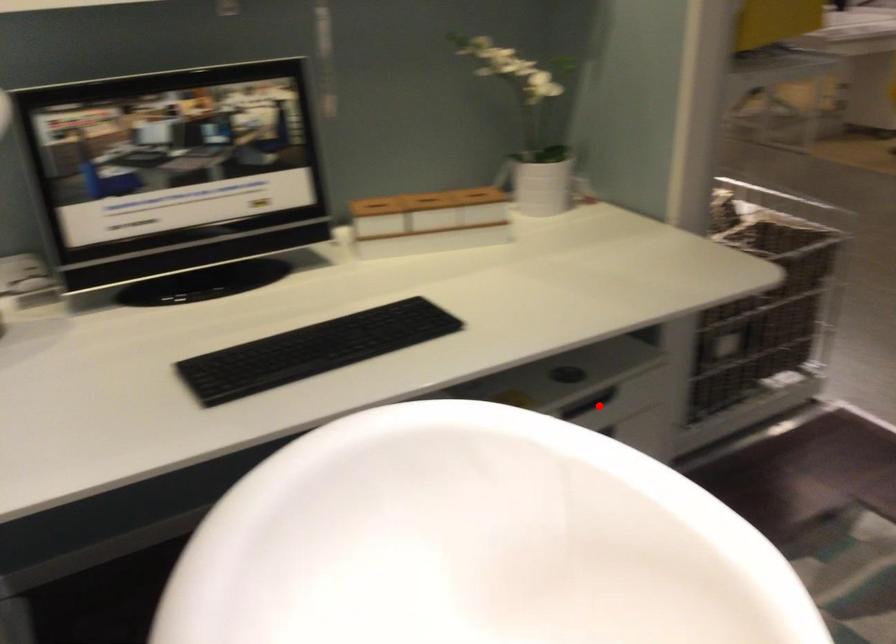
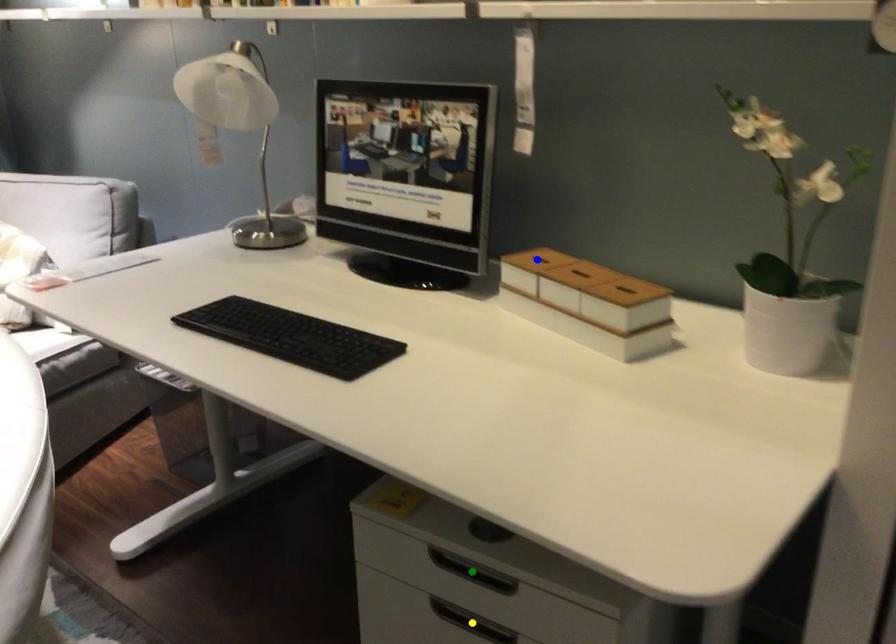
Question: I am providing you with two images of the same scene from different viewpoints. A red point is marked on the first image. You are given multiple points on the second image. Which spot in image 2 lines up with the point in image 1?

Choices:
 (A) green point
 (B) blue point
 (C) yellow point

Answer: (A)